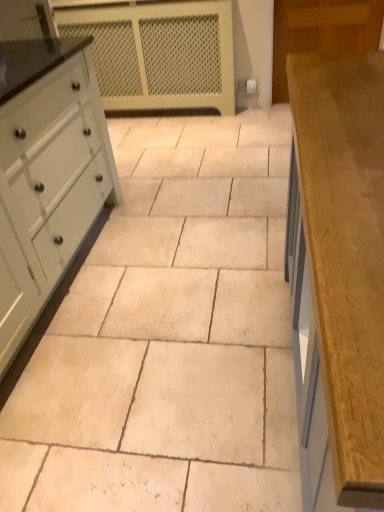
Question: From the image's perspective, is beige stone tile at center below white painted wood chest of drawers at left?

Choices:
 (A) no
 (B) yes

Answer: (B)

Question: Considering the relative sizes of beige stone tile at center and white painted wood chest of drawers at left in the image provided, is beige stone tile at center taller than white painted wood chest of drawers at left?

Choices:
 (A) yes
 (B) no

Answer: (B)

Question: Is beige stone tile at center to the right of white painted wood chest of drawers at left from the viewer's perspective?

Choices:
 (A) yes
 (B) no

Answer: (A)

Question: Does beige stone tile at center have a lesser width compared to white painted wood chest of drawers at left?

Choices:
 (A) yes
 (B) no

Answer: (B)

Question: Can you confirm if beige stone tile at center is wider than white painted wood chest of drawers at left?

Choices:
 (A) no
 (B) yes

Answer: (B)

Question: From the image's perspective, is white mesh radiator at upper center positioned above or below white painted wood chest of drawers at left?

Choices:
 (A) below
 (B) above

Answer: (B)

Question: Considering the positions of white mesh radiator at upper center and white painted wood chest of drawers at left in the image, is white mesh radiator at upper center taller or shorter than white painted wood chest of drawers at left?

Choices:
 (A) tall
 (B) short

Answer: (A)

Question: Would you say white mesh radiator at upper center is inside or outside white painted wood chest of drawers at left?

Choices:
 (A) inside
 (B) outside

Answer: (B)

Question: Based on their positions, is white mesh radiator at upper center located to the left or right of white painted wood chest of drawers at left?

Choices:
 (A) left
 (B) right

Answer: (B)

Question: In terms of width, does white painted wood chest of drawers at left look wider or thinner when compared to beige stone tile at center?

Choices:
 (A) wide
 (B) thin

Answer: (B)

Question: From their relative heights in the image, would you say white painted wood chest of drawers at left is taller or shorter than beige stone tile at center?

Choices:
 (A) tall
 (B) short

Answer: (A)

Question: From a real-world perspective, is white painted wood chest of drawers at left physically located above or below beige stone tile at center?

Choices:
 (A) above
 (B) below

Answer: (A)

Question: Based on their sizes in the image, would you say white painted wood chest of drawers at left is bigger or smaller than beige stone tile at center?

Choices:
 (A) big
 (B) small

Answer: (A)

Question: From a real-world perspective, is white painted wood chest of drawers at left positioned above or below wooden countertop at right?

Choices:
 (A) below
 (B) above

Answer: (B)

Question: Considering their positions, is white painted wood chest of drawers at left located in front of or behind wooden countertop at right?

Choices:
 (A) behind
 (B) front

Answer: (A)